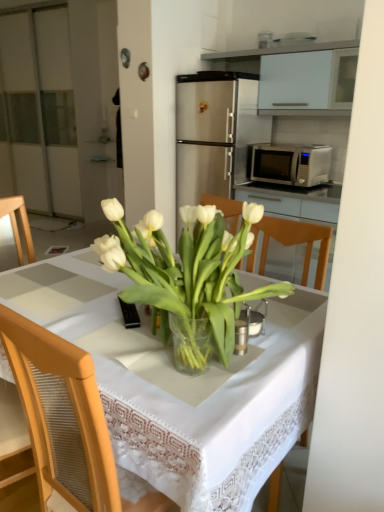
Question: From the image's perspective, relative to white glass vase at center, is transparent glass vase at center above or below?

Choices:
 (A) below
 (B) above

Answer: (A)

Question: Visually, is transparent glass vase at center positioned to the left or to the right of white glass vase at center?

Choices:
 (A) left
 (B) right

Answer: (A)

Question: Which object is positioned farthest from the white glossy cabinet at upper center?

Choices:
 (A) transparent glass vase at center
 (B) black plastic remote control at center
 (C) white glass vase at center
 (D) satin silver microwave at center right

Answer: (B)

Question: Considering the real-world distances, which object is farthest from the white glossy cabinet at upper center?

Choices:
 (A) white glass vase at center
 (B) transparent glass vase at center
 (C) satin silver microwave at center right
 (D) black plastic remote control at center

Answer: (D)